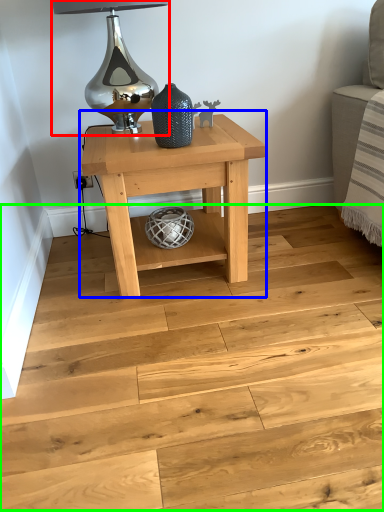
Question: Estimate the real-world distances between objects in this image. Which object is closer to table lamp (highlighted by a red box), table (highlighted by a blue box) or stair (highlighted by a green box)?

Choices:
 (A) table
 (B) stair

Answer: (A)